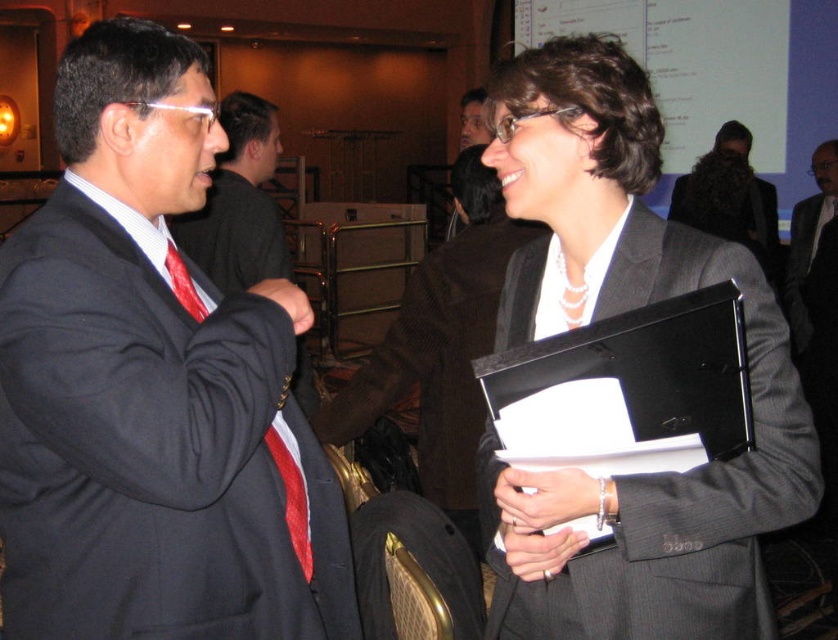
Between matte black suit at left and dark brown wool suit at center, which one has more height?

With more height is matte black suit at left.

Does point (107, 60) lie behind point (420, 320)?

That is False.

Which is in front, point (176, 483) or point (436, 288)?

Point (176, 483) is in front.

The width and height of the screenshot is (838, 640). Find the location of `matte black suit at left`. matte black suit at left is located at coordinates (153, 388).

Which is in front, point (469, 284) or point (185, 273)?

Positioned in front is point (185, 273).

Between dark brown wool suit at center and red striped tie at left, which one has less height?

With less height is red striped tie at left.

Between point (500, 284) and point (309, 532), which one is positioned behind?

Point (500, 284)

Where is `dark brown wool suit at center`? dark brown wool suit at center is located at coordinates (437, 362).

Is matte black suit at left wider than red striped tie at left?

Yes.

Which is below, matte black suit at left or red striped tie at left?

red striped tie at left is lower down.

Where is `matte black suit at left`? The width and height of the screenshot is (838, 640). matte black suit at left is located at coordinates (153, 388).